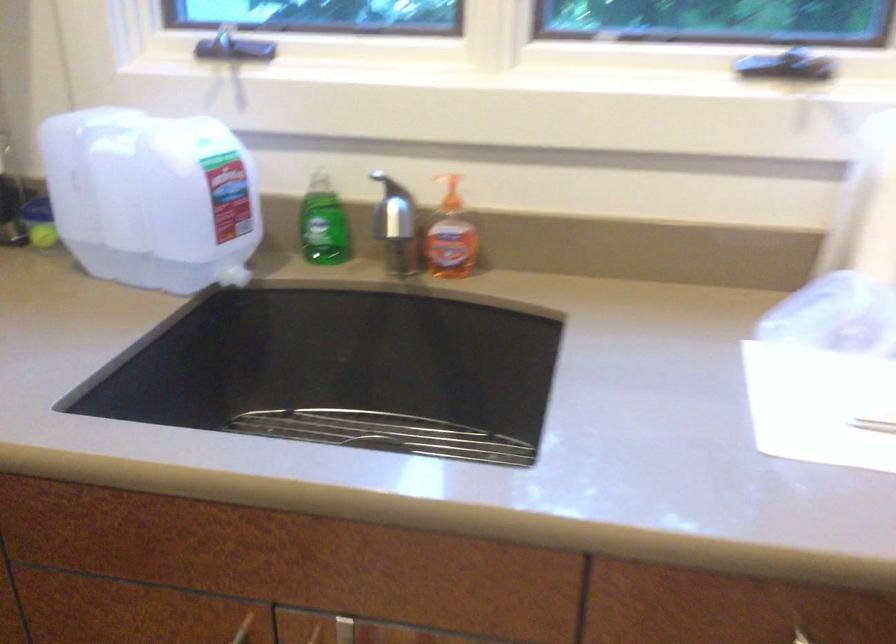
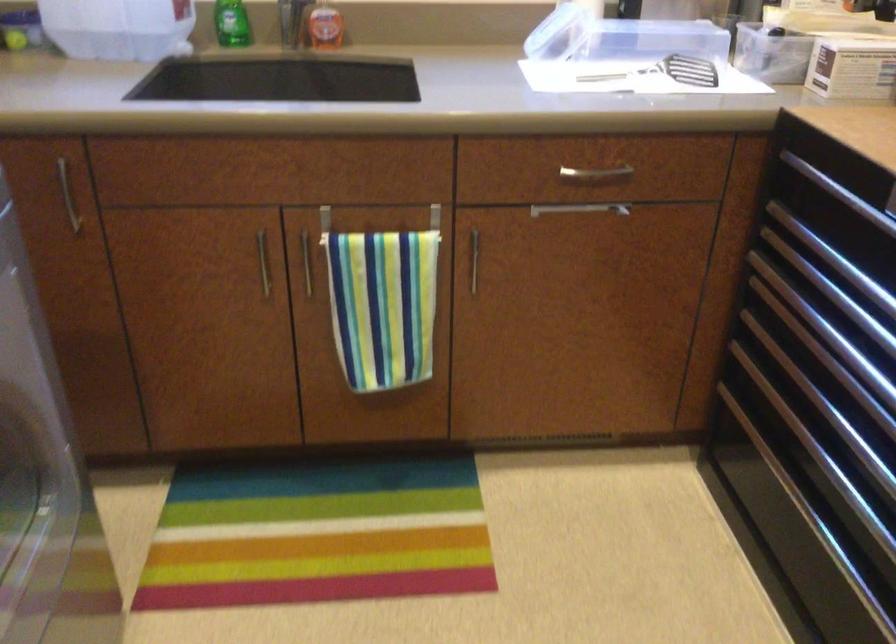
Question: Based on the continuous images, in which direction is the camera rotating? Reply with the corresponding letter.

Choices:
 (A) Left
 (B) Right
 (C) Up
 (D) Down

Answer: (B)